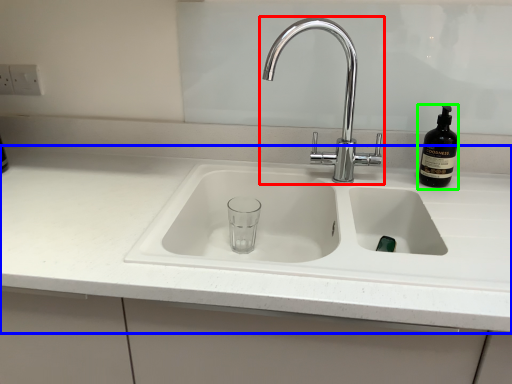
Question: Considering the real-world distances, which object is farthest from tap (highlighted by a red box)? countertop (highlighted by a blue box) or bottle (highlighted by a green box)?

Choices:
 (A) countertop
 (B) bottle

Answer: (A)